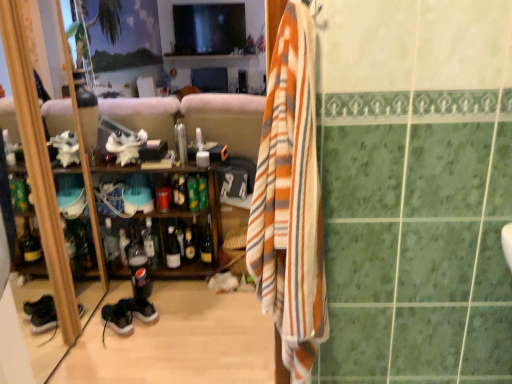
Question: Relative to shiny dark glass bottle at center, acting as the third bottle starting from the right, is green glass bottle at center, positioned as the eighth bottle in left-to-right order, in front or behind?

Choices:
 (A) behind
 (B) front

Answer: (B)

Question: Does point (192, 177) appear closer or farther from the camera than point (186, 246)?

Choices:
 (A) farther
 (B) closer

Answer: (B)

Question: Based on their relative distances, which object is nearer to the translucent glass bottle at center, which is the 5th bottle in left-to-right order?

Choices:
 (A) translucent plastic bottle at center, arranged as the eighth bottle when viewed from the right
 (B) wooden cabinet at left
 (C) suede black shoe at lower left
 (D) green glass bottle at center, which appears as the 2th bottle when viewed from the right
 (E) matte glass bottle at center, which is the fourth bottle from right to left

Answer: (E)

Question: Considering the real-world distances, which object is farthest from the transparent plastic faucet at center?

Choices:
 (A) matte glass bottle at center, which appears as the sixth bottle when viewed from the left
 (B) suede black shoe at lower left
 (C) translucent plastic bottle at center, arranged as the eighth bottle when viewed from the right
 (D) matte plastic soda bottle at center, placed as the seventh bottle when sorted from right to left
 (E) shiny gold bottle at center, the 1th bottle from the right

Answer: (B)